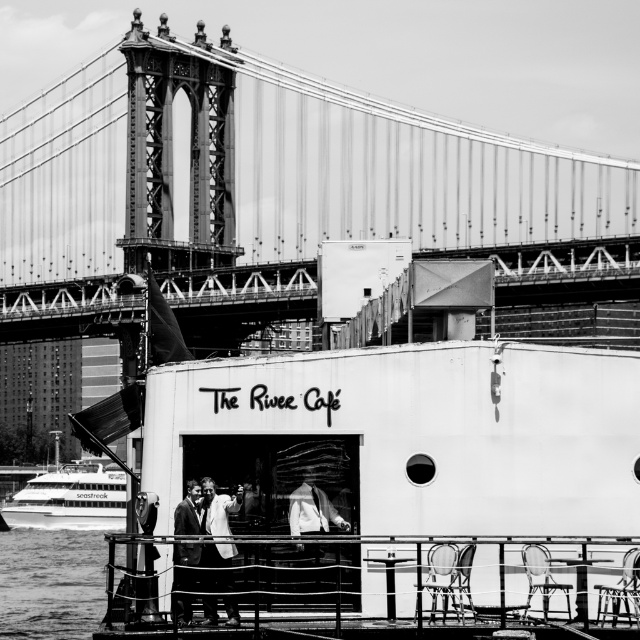
You are a photographer standing at the waterfront scene. You want to take a photo of both the metallic bridge at upper center and the white fabric coat at center. Since you have a camera with a fixed focal length, you need to adjust your position so that both objects fit in the frame. Considering their sizes, which object should you focus on to ensure both are visible?

The metallic bridge at upper center is larger than the white fabric coat at center. To include both in the frame, you should position yourself so that the metallic bridge at upper center is centered, and the white fabric coat at center is placed near the edges where it can still be captured without cropping either object.

You are a photographer planning to take a photo of the waterfront scene. You want to ensure that the smooth water at lower left and the white fabric at center are both visible in your shot. Based on their positions, which object should you position closer to the bottom of the frame to include both?

The smooth water at lower left is taller than the white fabric at center, so you should position the smooth water at lower left closer to the bottom of the frame to include both in the shot.